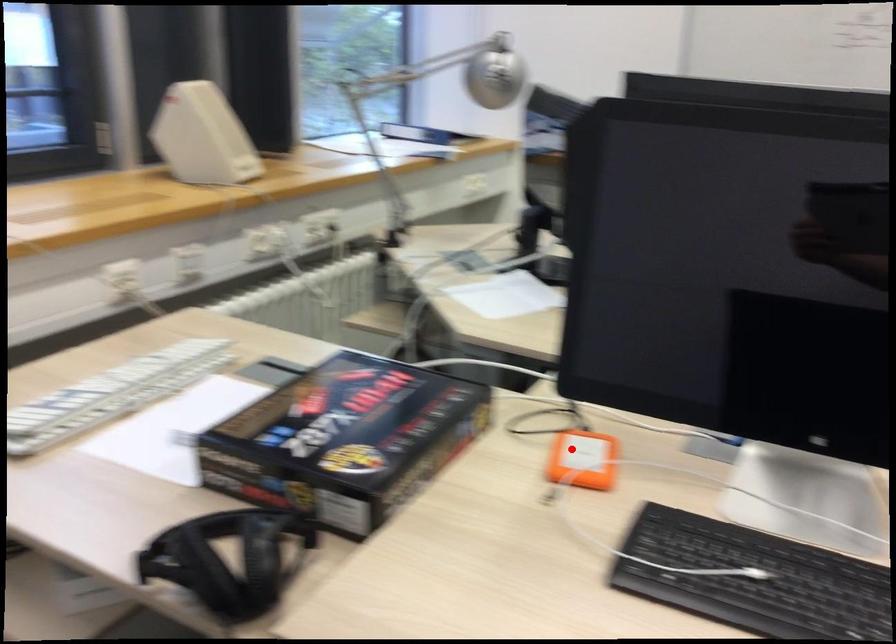
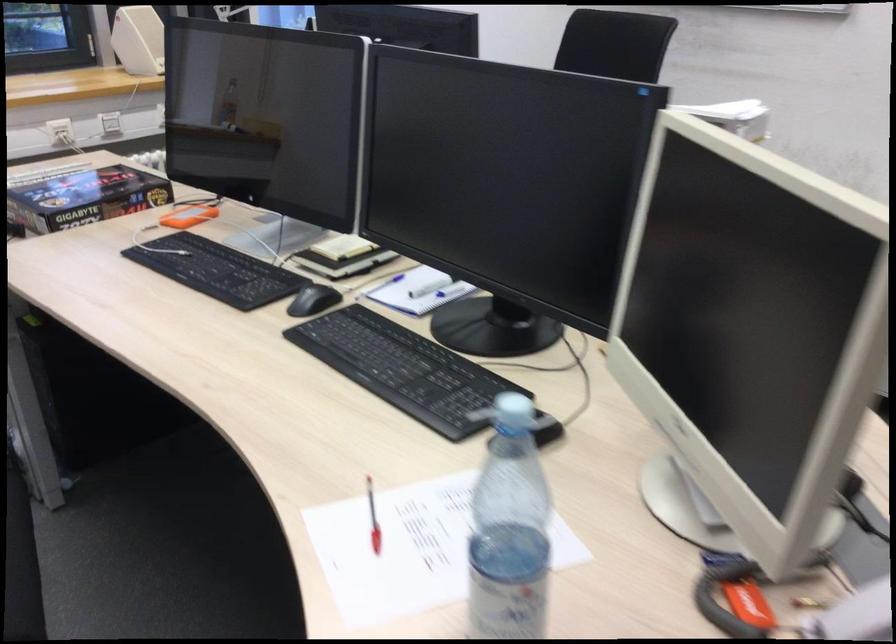
Question: I am providing you with two images of the same scene from different viewpoints. Given a red point in image1, look at the same physical point in image2. Is it:

Choices:
 (A) Closer to the viewpoint
 (B) Farther from the viewpoint

Answer: (B)